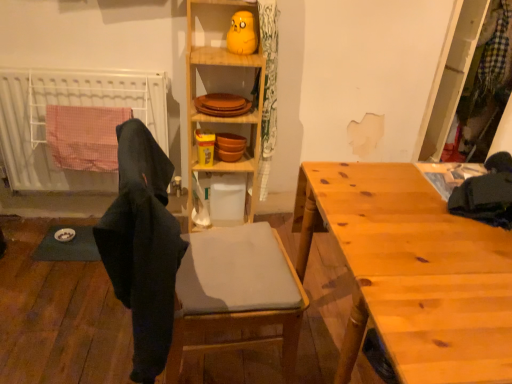
Question: Is wooden plates at upper center to the left of white plastic radiator at left from the viewer's perspective?

Choices:
 (A) no
 (B) yes

Answer: (A)

Question: Does wooden plates at upper center have a greater width compared to white plastic radiator at left?

Choices:
 (A) yes
 (B) no

Answer: (A)

Question: Can you confirm if wooden plates at upper center is smaller than white plastic radiator at left?

Choices:
 (A) yes
 (B) no

Answer: (A)

Question: From a real-world perspective, is wooden plates at upper center over white plastic radiator at left?

Choices:
 (A) no
 (B) yes

Answer: (B)

Question: From the image's perspective, is wooden plates at upper center on white plastic radiator at left?

Choices:
 (A) yes
 (B) no

Answer: (A)

Question: Is wooden table at right situated inside wooden cabinet at center or outside?

Choices:
 (A) outside
 (B) inside

Answer: (A)

Question: Is point (477, 379) closer or farther from the camera than point (251, 67)?

Choices:
 (A) closer
 (B) farther

Answer: (A)

Question: From the image's perspective, is wooden table at right above or below wooden cabinet at center?

Choices:
 (A) above
 (B) below

Answer: (B)

Question: From a real-world perspective, is wooden table at right above or below wooden cabinet at center?

Choices:
 (A) above
 (B) below

Answer: (B)

Question: Is point (245, 44) positioned closer to the camera than point (152, 92)?

Choices:
 (A) farther
 (B) closer

Answer: (B)

Question: From the image's perspective, relative to white plastic radiator at left, is matte yellow rubber duck at upper center above or below?

Choices:
 (A) above
 (B) below

Answer: (A)

Question: Based on their sizes in the image, would you say matte yellow rubber duck at upper center is bigger or smaller than white plastic radiator at left?

Choices:
 (A) small
 (B) big

Answer: (A)

Question: Looking at their shapes, would you say matte yellow rubber duck at upper center is wider or thinner than white plastic radiator at left?

Choices:
 (A) thin
 (B) wide

Answer: (A)

Question: From a real-world perspective, is wooden table at right physically located above or below white plastic radiator at left?

Choices:
 (A) above
 (B) below

Answer: (B)

Question: In terms of height, does wooden table at right look taller or shorter compared to white plastic radiator at left?

Choices:
 (A) short
 (B) tall

Answer: (B)